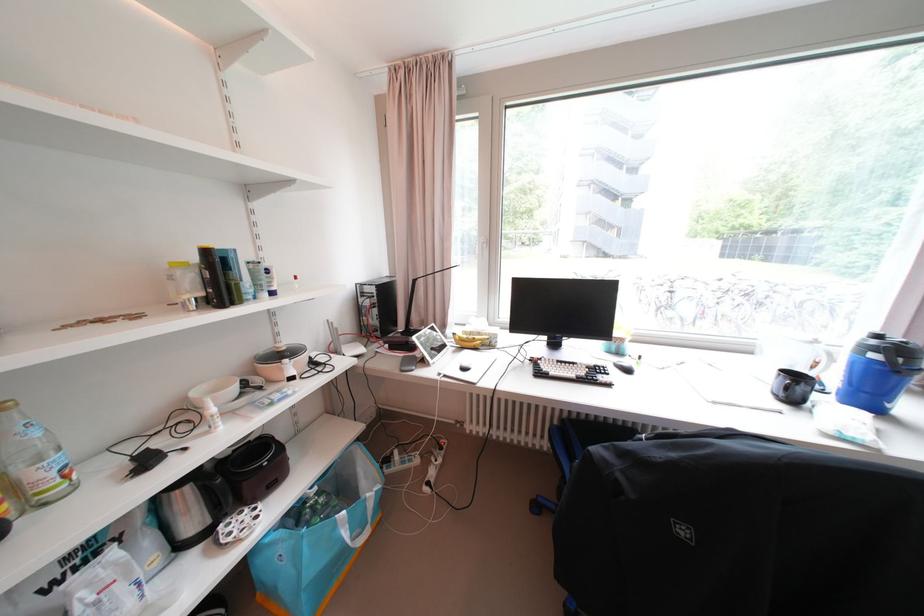
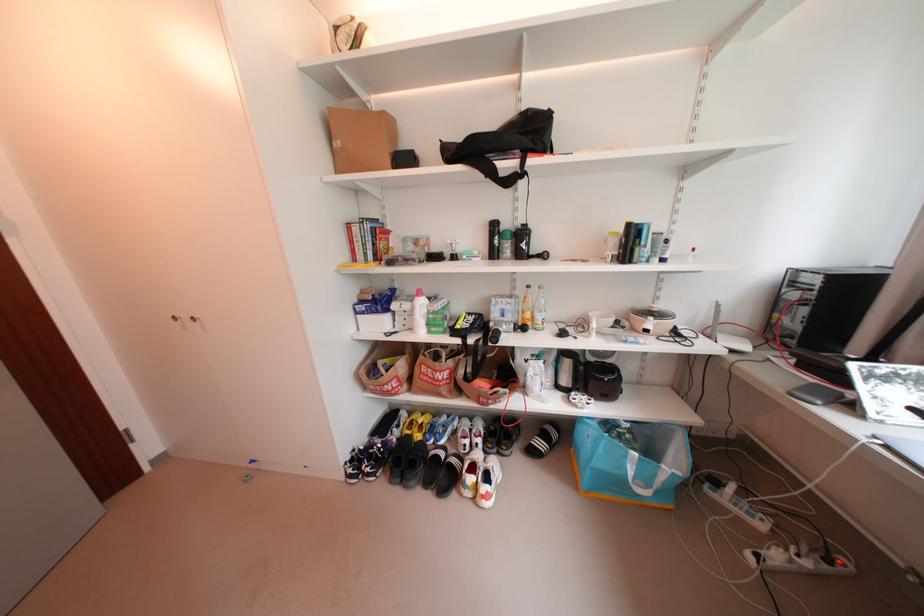
Locate, in the second image, the point that corresponds to [217,523] in the first image.

(578, 387)